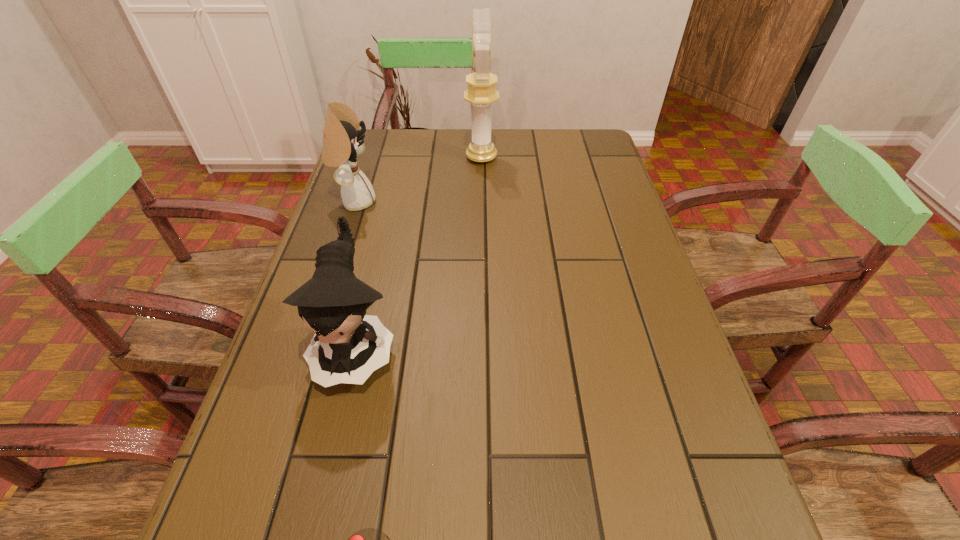
Locate an element on the screen. vacant region between the nearer doll and the award is located at coordinates (419, 252).

This screenshot has width=960, height=540. I want to click on the closest object to the farther doll, so click(x=481, y=93).

I want to click on object that ranks as the second closest to the farthest object, so click(x=347, y=347).

I want to click on free space in the image that satisfies the following two spatial constraints: 1. on the front-facing side of the farthest object; 2. at the face of the third farthest object, so click(482, 346).

Locate an element on the screen. Image resolution: width=960 pixels, height=540 pixels. vacant area that satisfies the following two spatial constraints: 1. on the front-facing side of the award; 2. at the face of the nearer doll is located at coordinates (482, 346).

I want to click on vacant region that satisfies the following two spatial constraints: 1. on the front-facing side of the rightmost object; 2. at the face of the nearer doll, so click(482, 346).

Identify the location of free location that satisfies the following two spatial constraints: 1. on the front-facing side of the award; 2. at the face of the second nearest object. (482, 346).

The height and width of the screenshot is (540, 960). Find the location of `free spot that satisfies the following two spatial constraints: 1. on the front-facing side of the farthest object; 2. at the face of the third farthest object`. free spot that satisfies the following two spatial constraints: 1. on the front-facing side of the farthest object; 2. at the face of the third farthest object is located at coordinates (482, 346).